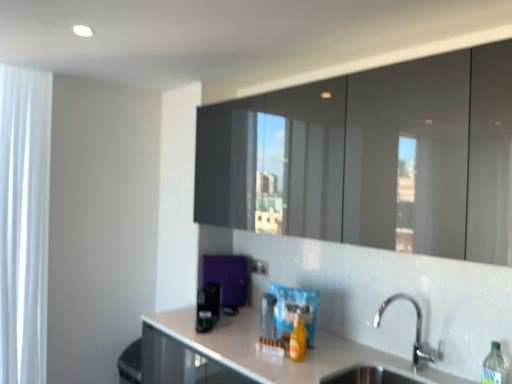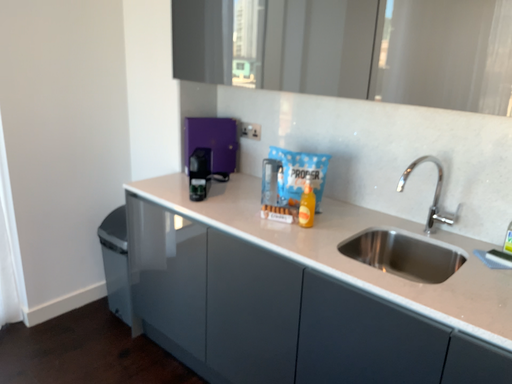
Question: How did the camera likely rotate when shooting the video?

Choices:
 (A) rotated right
 (B) rotated left

Answer: (A)